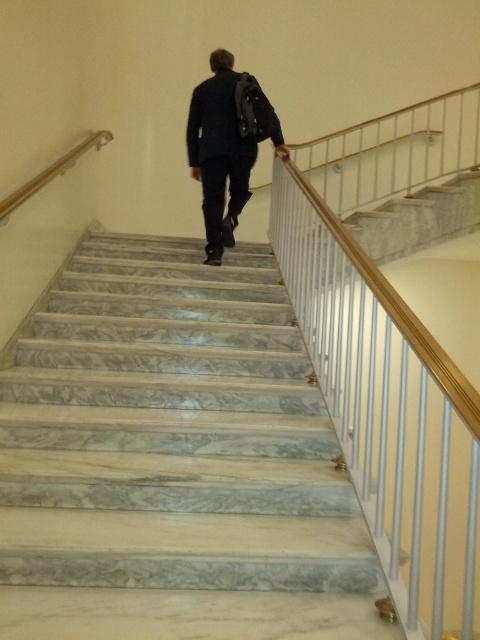
You are standing at the bottom of the staircase and want to reach the top. There are two points marked on the wall. The first is point (x=257, y=129) and the second is point (x=25, y=188). Which point is closer to you as you look up the staircase?

Point (x=257, y=129) is closer to you because it is further to the viewer than point (x=25, y=188), meaning it appears nearer in the image.

You are a person wearing the dark blue suit at center and need to walk up the marble stairs at center. Can you comfortably walk up the stairs without needing to adjust your position?

The marble stairs at center might be wider than dark blue suit at center, so it is likely that you can comfortably walk up the stairs without needing to adjust your position.